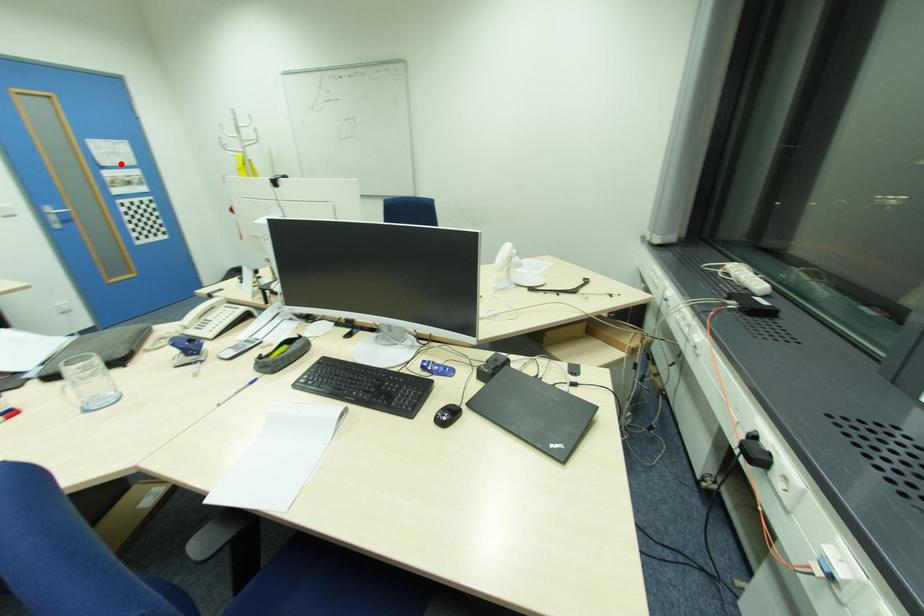
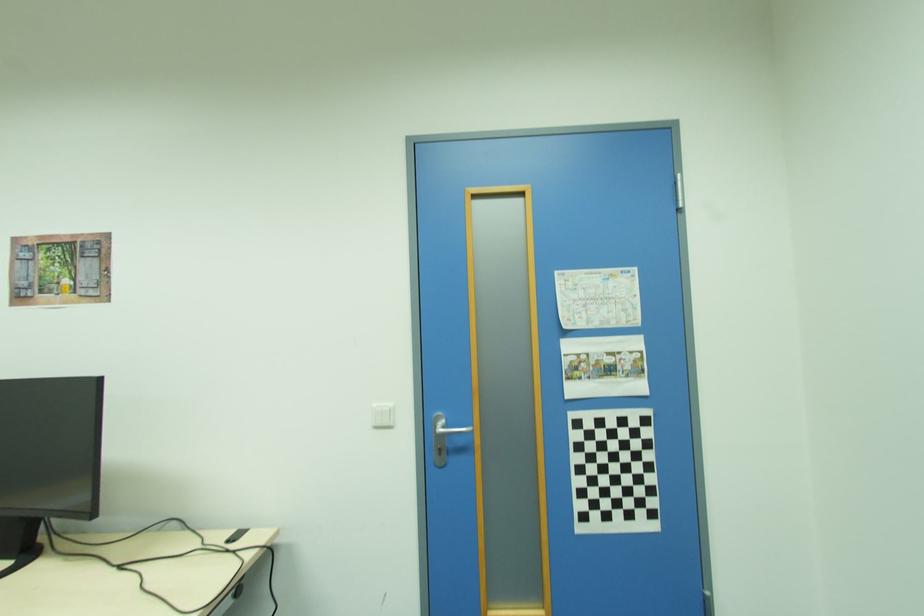
Question: I am providing you with two images of the same scene from different viewpoints. A red point is shown in image1. For the corresponding object point in image2, is it positioned nearer or farther from the camera?

Choices:
 (A) Nearer
 (B) Farther

Answer: (A)